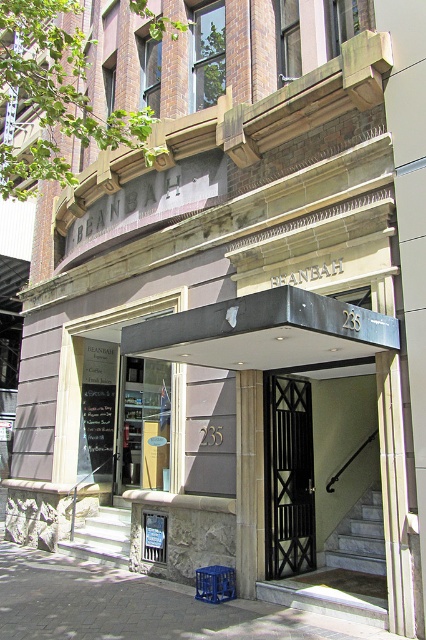
Looking at this image, can you confirm if black metal gate at center is taller than clear glass door at center?

No, black metal gate at center is not taller than clear glass door at center.

Can you confirm if black metal gate at center is positioned below clear glass door at center?

Yes, black metal gate at center is below clear glass door at center.

Which is in front, point (307, 440) or point (141, 371)?

Point (307, 440)

The image size is (426, 640). I want to click on black metal gate at center, so click(x=287, y=477).

Who is positioned more to the right, paved stone pavement at lower center or smooth stone column at center?

smooth stone column at center is more to the right.

In the scene shown: Between paved stone pavement at lower center and smooth stone column at center, which one appears on the left side from the viewer's perspective?

paved stone pavement at lower center

You are a GUI agent. You are given a task and a screenshot of the screen. Output one action in this format:
    pyautogui.click(x=<x>, y=<y>)
    Task: Click on the paved stone pavement at lower center
    
    Given the screenshot: What is the action you would take?
    138,605

Where is `paved stone pavement at lower center`? paved stone pavement at lower center is located at coordinates (138, 605).

How far apart are paved stone pavement at lower center and black metal gate at center?

1.56 meters

Is paved stone pavement at lower center bigger than black metal gate at center?

No, paved stone pavement at lower center is not bigger than black metal gate at center.

Which is in front, point (25, 602) or point (271, 513)?

Point (25, 602)

The image size is (426, 640). I want to click on paved stone pavement at lower center, so click(x=138, y=605).